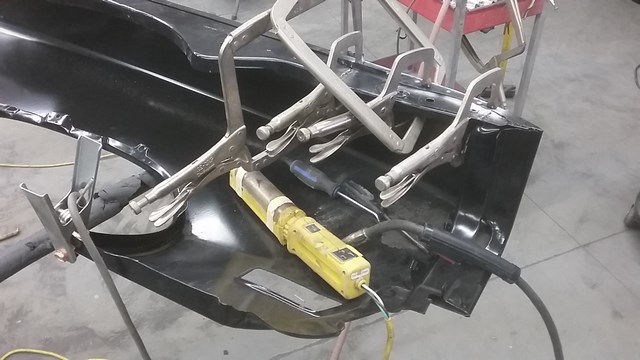
Identify the location of legs of cart. (532, 48), (456, 51).